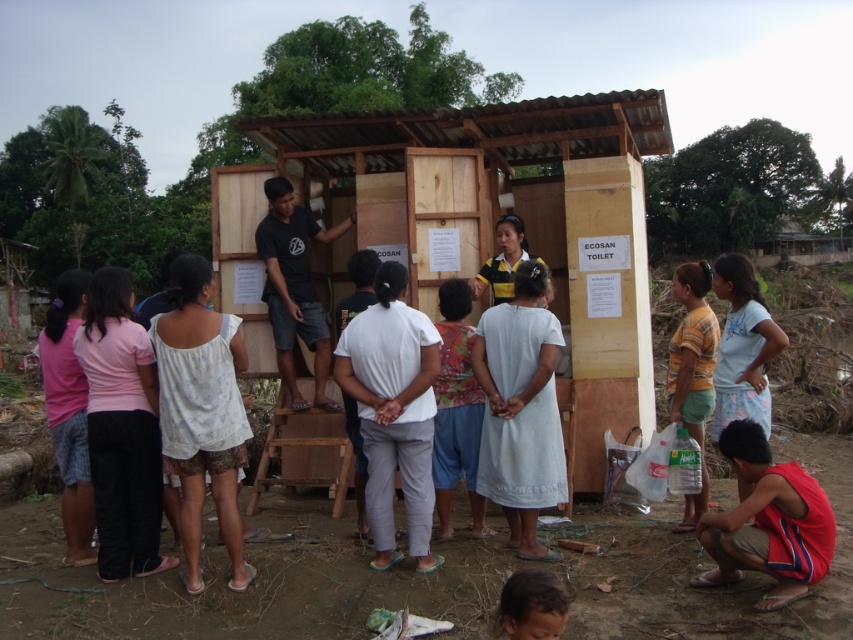
You are a construction worker planning to move the wooden shack at center and the brown hair at lower center to a new location. Which object requires a wider pathway for transportation?

The wooden shack at center requires a wider pathway because its width surpasses that of the brown hair at lower center.

You are standing in front of the ECOSAN TOILET and need to locate two specific points. The first point is at coordinate point (485, 230) and the second is at coordinate point (698, 513). Which point is closer to you?

Point (485, 230) is further to the camera than point (698, 513). Therefore, point (698, 513) is closer to you.